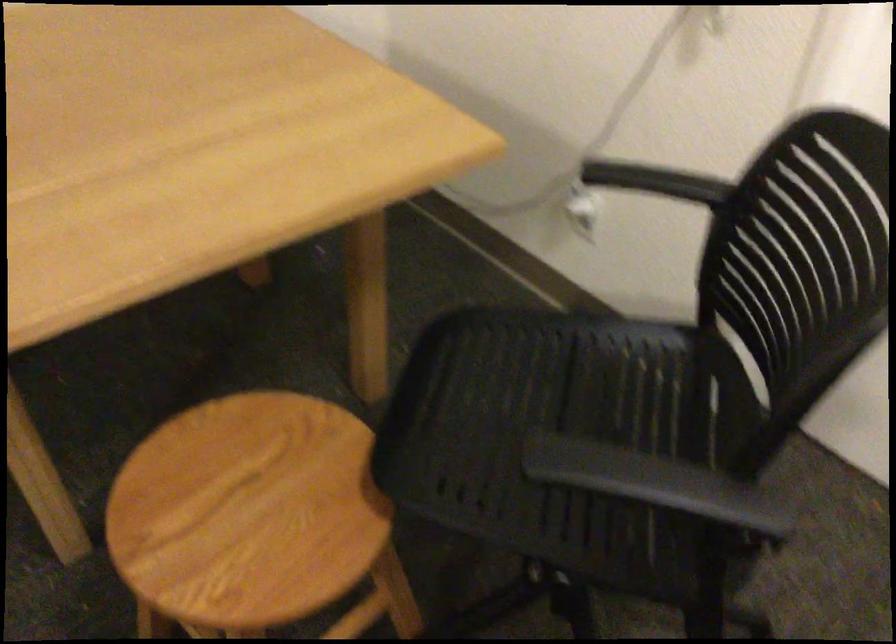
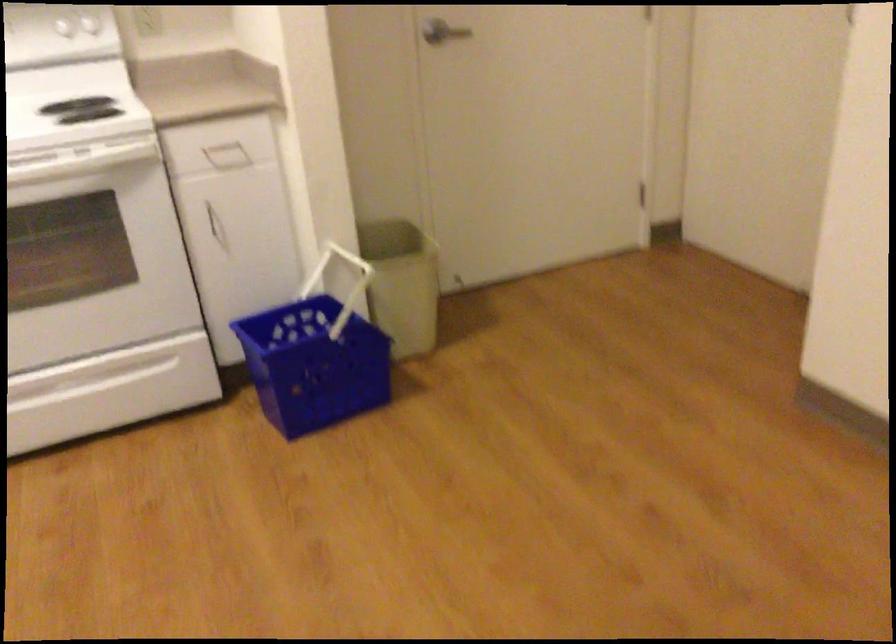
First-person continuous shooting, in which direction is the camera rotating?

The camera rotated toward left-down.